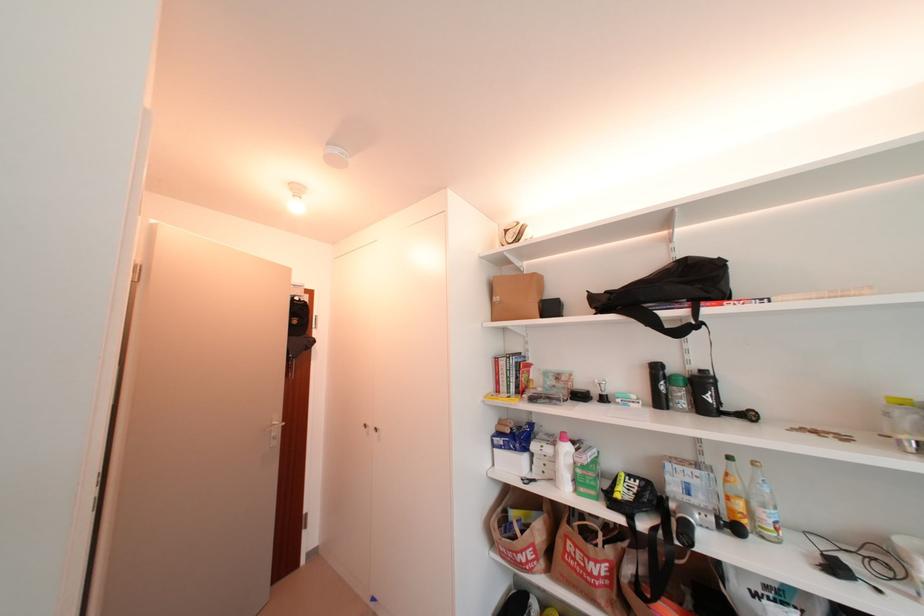
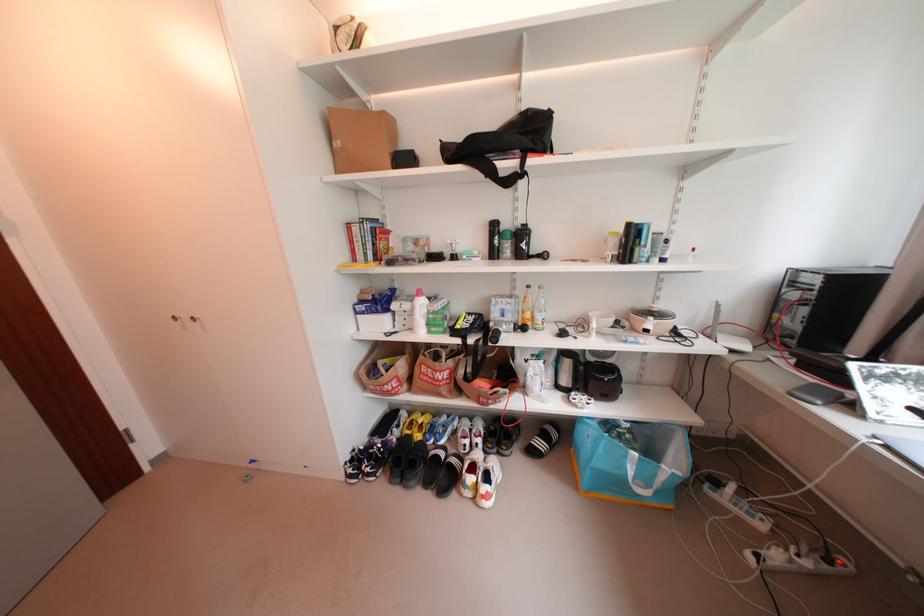
Find the pixel in the second image that matches the point at 552,474 in the first image.

(412, 326)